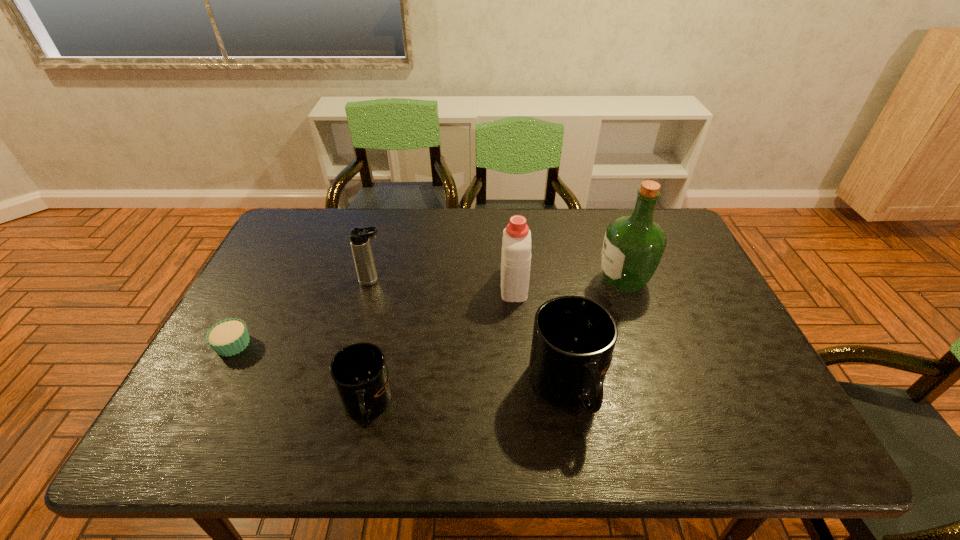
In the image, there is a desktop. Where is `vacant space at the left edge`? The image size is (960, 540). vacant space at the left edge is located at coordinates (268, 325).

Locate an element on the screen. The image size is (960, 540). vacant space at the right edge is located at coordinates (668, 258).

Identify the location of free space between the leftmost object and the thermos bottle. (303, 313).

Where is `vacant space in between the thermos bottle and the left mug`? Image resolution: width=960 pixels, height=540 pixels. vacant space in between the thermos bottle and the left mug is located at coordinates (370, 342).

The image size is (960, 540). In order to click on empty location between the second shortest object and the thermos bottle in this screenshot , I will do `click(370, 342)`.

Find the location of a particular element. free space between the rightmost object and the left mug is located at coordinates (494, 342).

Where is `empty space that is in between the rightmost object and the fifth shortest object`? The image size is (960, 540). empty space that is in between the rightmost object and the fifth shortest object is located at coordinates (568, 282).

This screenshot has height=540, width=960. I want to click on free point between the left mug and the shortest object, so click(300, 374).

You are a GUI agent. You are given a task and a screenshot of the screen. Output one action in this format:
    pyautogui.click(x=<x>, y=<y>)
    Task: Click on the empty space that is in between the thermos bottle and the right mug
    The image size is (960, 540).
    Given the screenshot: What is the action you would take?
    pyautogui.click(x=470, y=334)

Where is `vacant space in between the shortest object and the detergent`? The width and height of the screenshot is (960, 540). vacant space in between the shortest object and the detergent is located at coordinates (373, 314).